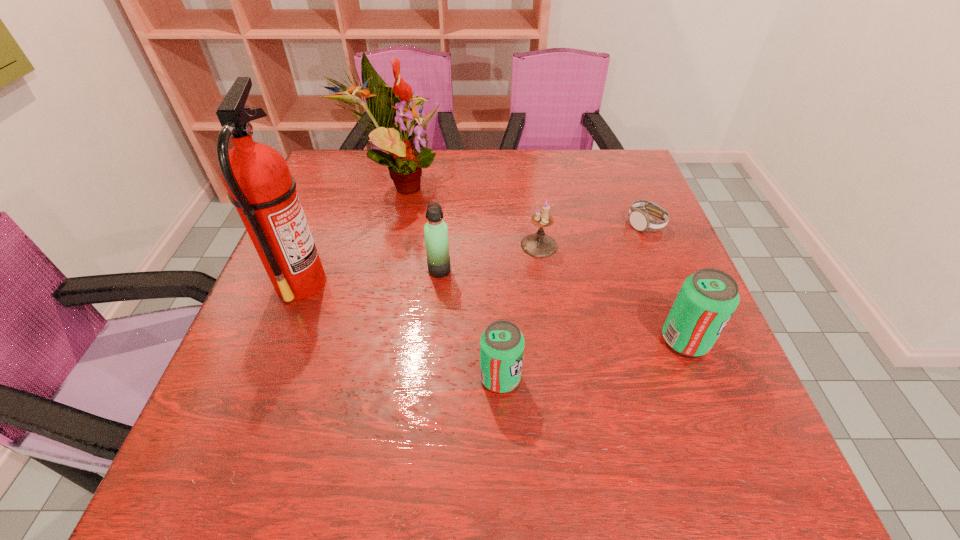
This screenshot has height=540, width=960. I want to click on vacant space located on the front-facing side of the bouquet, so click(x=573, y=184).

Locate an element on the screen. Image resolution: width=960 pixels, height=540 pixels. vacant space located 0.290m on the side of the fire extinguisher near the handle is located at coordinates (459, 282).

The image size is (960, 540). In order to click on free space located on the face of the shortest object in this screenshot , I will do coord(695,347).

Where is `blank area located 0.320m on the left of the fifth object from left to right`? The width and height of the screenshot is (960, 540). blank area located 0.320m on the left of the fifth object from left to right is located at coordinates (388, 245).

Where is `free space located on the right of the thermos bottle`? Image resolution: width=960 pixels, height=540 pixels. free space located on the right of the thermos bottle is located at coordinates (592, 270).

Where is `object positioned at the far edge`? object positioned at the far edge is located at coordinates (388, 107).

What are the coordinates of `object located in the near edge section of the desktop` in the screenshot? It's located at (502, 344).

Where is `bouquet that is positioned at the left edge`? bouquet that is positioned at the left edge is located at coordinates (388, 107).

The height and width of the screenshot is (540, 960). Identify the location of fire extinguisher that is at the left edge. (260, 186).

Locate an element on the screen. pop soda that is at the right edge is located at coordinates (708, 298).